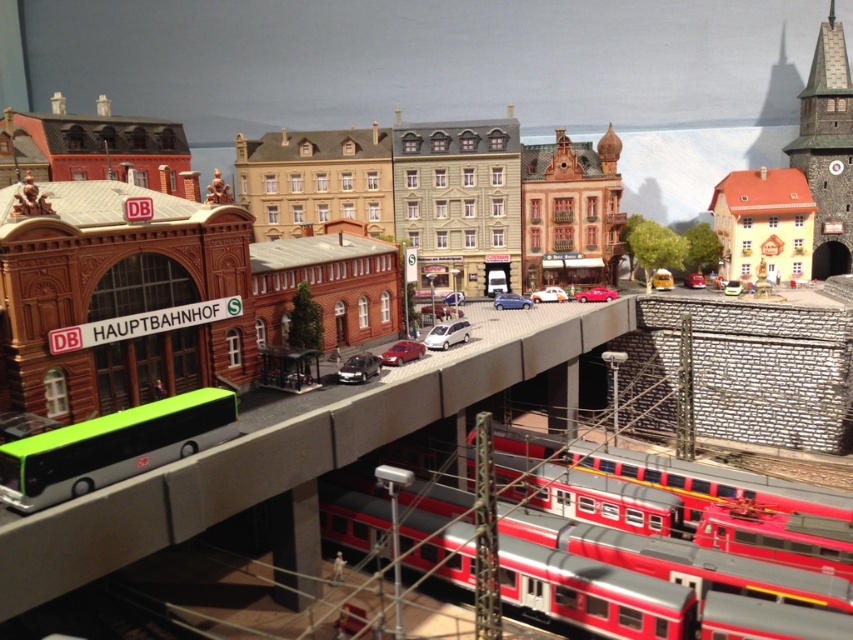
Question: Which of the following is the closest to the observer?

Choices:
 (A) satin red car at center
 (B) shiny red car at center
 (C) satin silver sedan at center
 (D) satin silver car at center

Answer: (A)

Question: Does red matte passenger train at lower center have a larger size compared to satin silver car at center?

Choices:
 (A) yes
 (B) no

Answer: (A)

Question: Which point is farther to the camera?

Choices:
 (A) (439, 548)
 (B) (538, 300)

Answer: (B)

Question: Can you confirm if red matte passenger train at lower center is positioned to the left of satin red car at center?

Choices:
 (A) no
 (B) yes

Answer: (A)

Question: Which of the following is the closest to the observer?

Choices:
 (A) shiny black sedan at center
 (B) white glossy car at center
 (C) shiny red car at center

Answer: (A)

Question: Does concrete bridge at center lie in front of shiny black sedan at center?

Choices:
 (A) no
 (B) yes

Answer: (B)